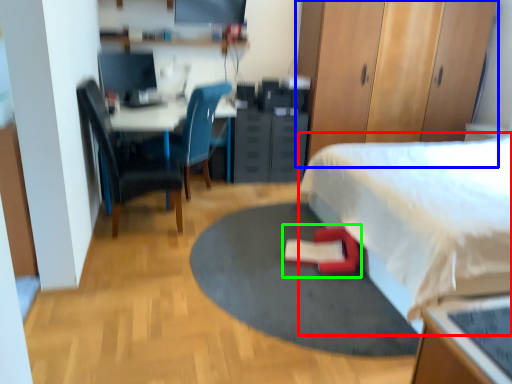
Question: Which object is positioned closest to bed (highlighted by a red box)? Select from dresser (highlighted by a blue box) and bean bag chair (highlighted by a green box).

Choices:
 (A) dresser
 (B) bean bag chair

Answer: (B)